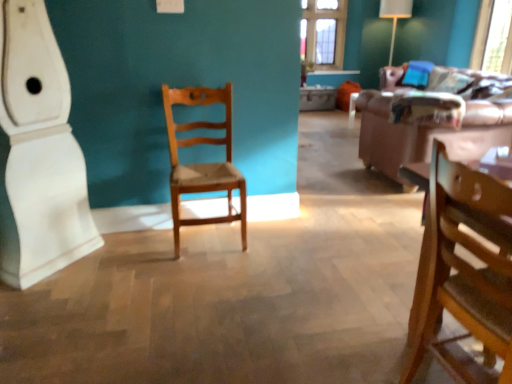
Question: Does brown leather couch at right have a larger size compared to transparent glass window screen at upper right?

Choices:
 (A) no
 (B) yes

Answer: (B)

Question: Considering the relative sizes of brown leather couch at right and transparent glass window screen at upper right in the image provided, is brown leather couch at right shorter than transparent glass window screen at upper right?

Choices:
 (A) no
 (B) yes

Answer: (B)

Question: Would you consider brown leather couch at right to be distant from transparent glass window screen at upper right?

Choices:
 (A) no
 (B) yes

Answer: (A)

Question: Considering the relative positions of brown leather couch at right and transparent glass window screen at upper right in the image provided, is brown leather couch at right to the left of transparent glass window screen at upper right from the viewer's perspective?

Choices:
 (A) no
 (B) yes

Answer: (B)

Question: From the image's perspective, is brown leather couch at right located above transparent glass window screen at upper right?

Choices:
 (A) no
 (B) yes

Answer: (A)

Question: Looking at the image, does transparent glass window screen at upper right seem bigger or smaller compared to wooden chair at right, which is the first chair from right to left?

Choices:
 (A) small
 (B) big

Answer: (A)

Question: Relative to wooden chair at right, positioned as the 1th chair in front-to-back order, is transparent glass window screen at upper right in front or behind?

Choices:
 (A) behind
 (B) front

Answer: (A)

Question: Does point (506, 51) appear closer or farther from the camera than point (470, 334)?

Choices:
 (A) farther
 (B) closer

Answer: (A)

Question: Is transparent glass window screen at upper right wider or thinner than wooden chair at right, which is the first chair from right to left?

Choices:
 (A) thin
 (B) wide

Answer: (A)

Question: Considering the positions of brown leather couch at right and transparent glass window screen at upper right in the image, is brown leather couch at right wider or thinner than transparent glass window screen at upper right?

Choices:
 (A) wide
 (B) thin

Answer: (A)

Question: Would you say brown leather couch at right is inside or outside transparent glass window screen at upper right?

Choices:
 (A) inside
 (B) outside

Answer: (B)

Question: From a real-world perspective, relative to transparent glass window screen at upper right, is brown leather couch at right vertically above or below?

Choices:
 (A) below
 (B) above

Answer: (A)

Question: In terms of size, does brown leather couch at right appear bigger or smaller than transparent glass window screen at upper right?

Choices:
 (A) big
 (B) small

Answer: (A)

Question: In the image, is brown leather couch at right positioned in front of or behind wooden chair at right, positioned as the 1th chair in front-to-back order?

Choices:
 (A) front
 (B) behind

Answer: (B)

Question: Is brown leather couch at right bigger or smaller than wooden chair at right, which is counted as the 2th chair, starting from the left?

Choices:
 (A) small
 (B) big

Answer: (B)